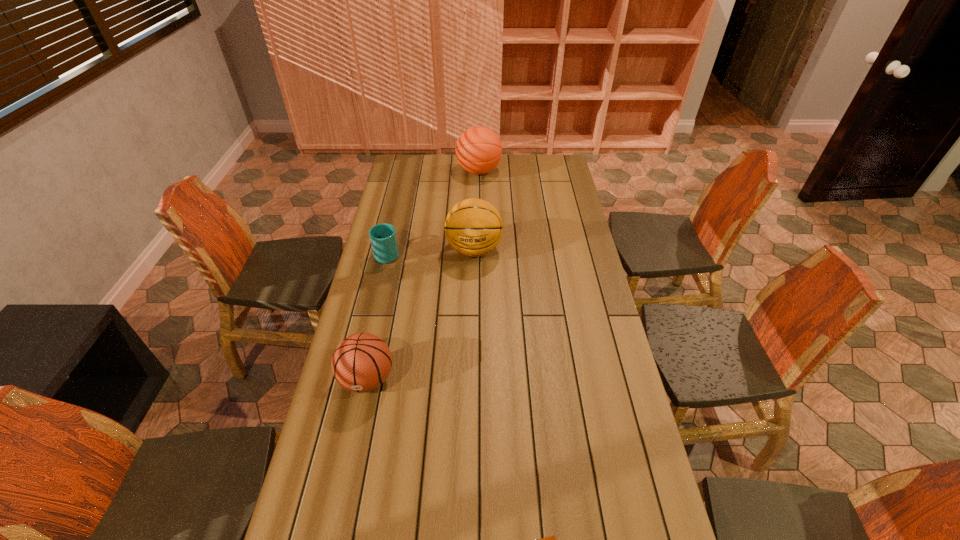
The width and height of the screenshot is (960, 540). Find the location of `free spot between the second shortest object and the second farthest basketball`. free spot between the second shortest object and the second farthest basketball is located at coordinates (431, 252).

The height and width of the screenshot is (540, 960). Identify the location of blank region between the farthest object and the nearest basketball. (423, 275).

The height and width of the screenshot is (540, 960). What are the coordinates of `free point between the farthest object and the cup` in the screenshot? It's located at (433, 212).

At what (x,y) coordinates should I click in order to perform the action: click on the closest object to the chocolate bar. Please return your answer as a coordinate pair (x, y). The height and width of the screenshot is (540, 960). Looking at the image, I should click on (361, 362).

At what (x,y) coordinates should I click in order to perform the action: click on object that stands as the second closest to the nearest basketball. Please return your answer as a coordinate pair (x, y). This screenshot has height=540, width=960. Looking at the image, I should click on (383, 239).

At what (x,y) coordinates should I click in order to perform the action: click on basketball that is the second closest to the nearest basketball. Please return your answer as a coordinate pair (x, y). Looking at the image, I should click on (478, 149).

Image resolution: width=960 pixels, height=540 pixels. I want to click on basketball identified as the second closest to the fourth tallest object, so click(361, 362).

Where is `free location that satisfies the following two spatial constraints: 1. on the handle side of the fourth tallest object; 2. on the left side of the farthest object`? The width and height of the screenshot is (960, 540). free location that satisfies the following two spatial constraints: 1. on the handle side of the fourth tallest object; 2. on the left side of the farthest object is located at coordinates (406, 171).

I want to click on free space that satisfies the following two spatial constraints: 1. on the handle side of the cup; 2. on the left side of the farthest basketball, so click(406, 171).